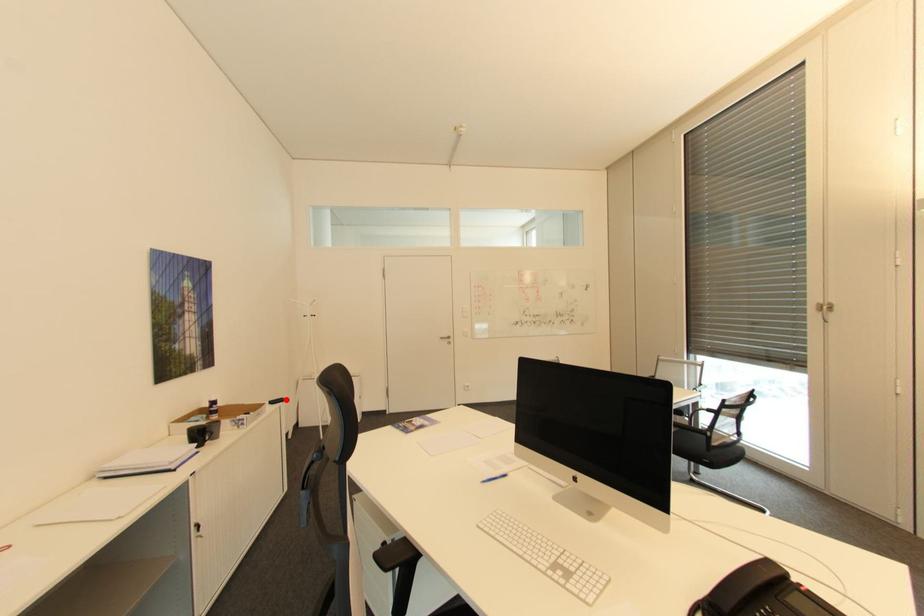
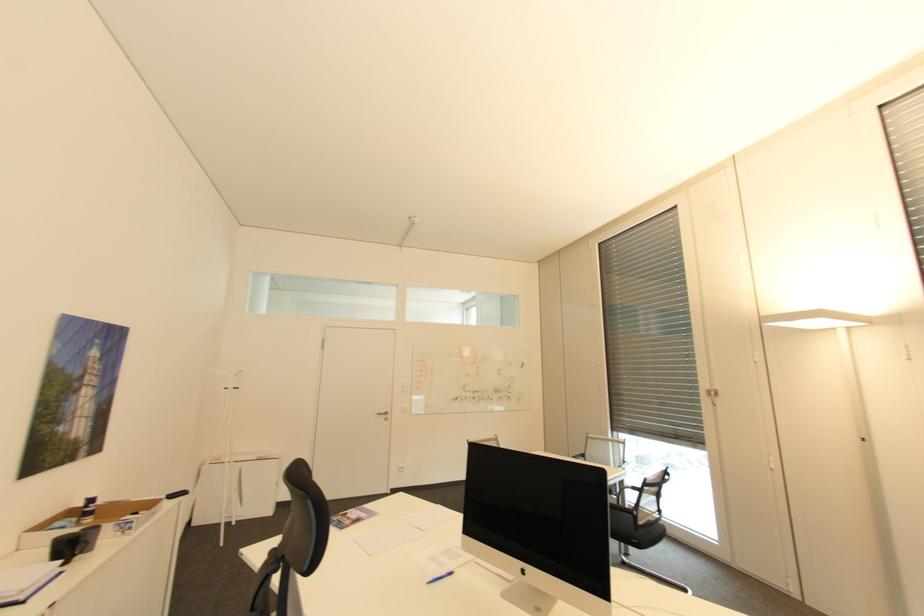
Question: A red point is marked in image1. In image2, is the corresponding 3D point closer to the camera or farther? Reply with the corresponding letter.

Choices:
 (A) The corresponding 3D point is closer.
 (B) The corresponding 3D point is farther.

Answer: (B)